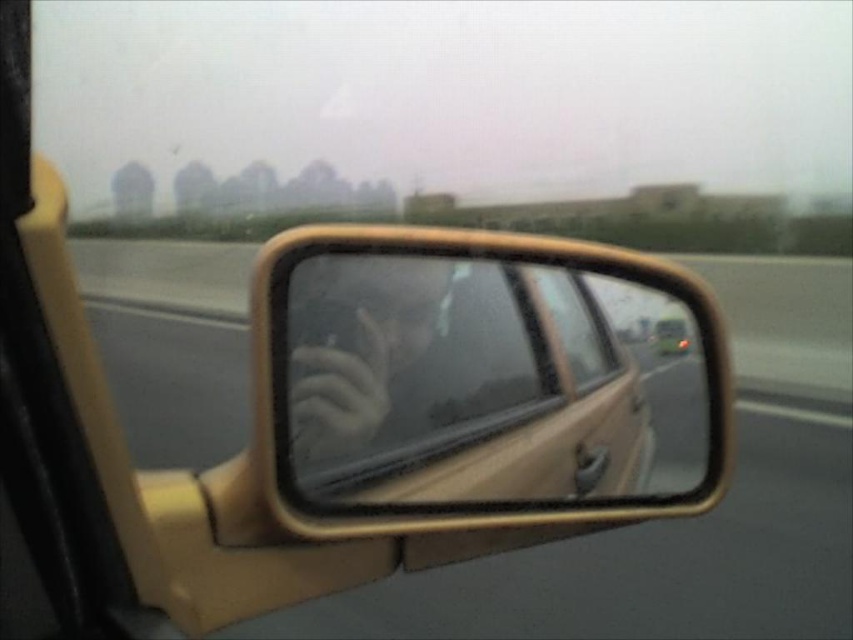
Measure the distance between point (x=289, y=394) and camera.

Point (x=289, y=394) is 1.05 meters from camera.

I want to click on matte yellow mirror at center, so click(479, 381).

Who is positioned more to the right, matte yellow mirror at center or clear glass car window at center?

From the viewer's perspective, clear glass car window at center appears more on the right side.

In the scene shown: Which is below, matte yellow mirror at center or clear glass car window at center?

matte yellow mirror at center

Locate an element on the screen. This screenshot has width=853, height=640. matte yellow mirror at center is located at coordinates (479, 381).

Between clear glass car window at center and matte black car at center, which one has less height?

Standing shorter between the two is matte black car at center.

Who is more forward, (592, 381) or (662, 348)?

Positioned in front is point (592, 381).

At what (x,y) coordinates should I click in order to perform the action: click on clear glass car window at center. Please return your answer as a coordinate pair (x, y). This screenshot has width=853, height=640. Looking at the image, I should click on (576, 324).